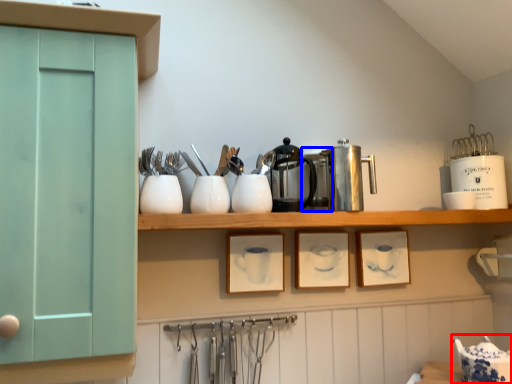
Question: Which object is further to the camera taking this photo, tableware (highlighted by a red box) or appliance (highlighted by a blue box)?

Choices:
 (A) tableware
 (B) appliance

Answer: (B)